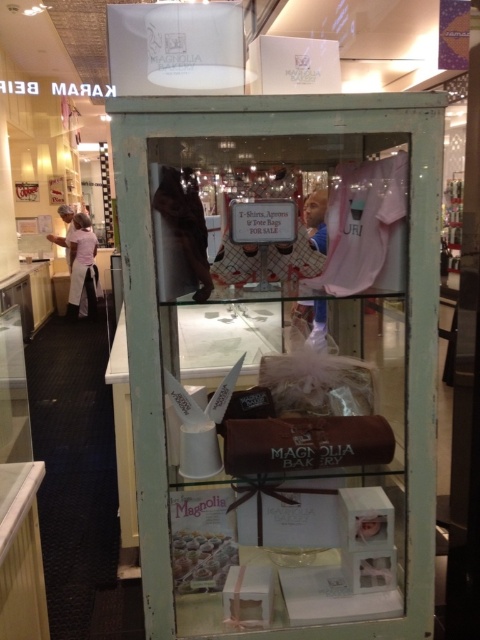
Question: Observing the image, what is the correct spatial positioning of matte pink fabric at center in reference to white apron at left?

Choices:
 (A) above
 (B) below

Answer: (B)

Question: Estimate the real-world distances between objects in this image. Which object is farther from the matte pink fabric at center?

Choices:
 (A) white apron at left
 (B) white glossy cake at lower center

Answer: (A)

Question: Which point is closer to the camera?

Choices:
 (A) (183, 540)
 (B) (368, 445)
 (C) (81, 243)

Answer: (B)

Question: Does matte pink fabric at center have a larger size compared to white apron at left?

Choices:
 (A) no
 (B) yes

Answer: (B)

Question: Estimate the real-world distances between objects in this image. Which object is closer to the matte pink fabric at center?

Choices:
 (A) white glossy cake at lower center
 (B) white apron at left

Answer: (A)

Question: Observing the image, what is the correct spatial positioning of matte pink fabric at center in reference to white apron at left?

Choices:
 (A) below
 (B) above

Answer: (A)